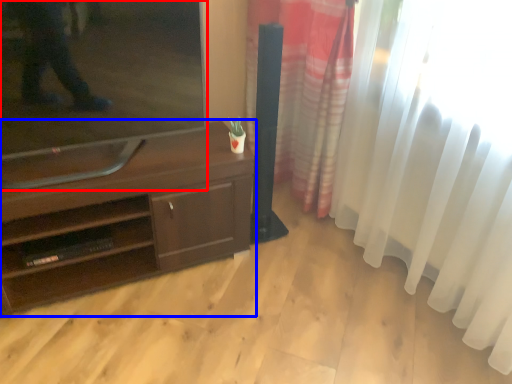
Question: Which point is closer to the camera, television (highlighted by a red box) or desk (highlighted by a blue box)?

Choices:
 (A) television
 (B) desk

Answer: (A)